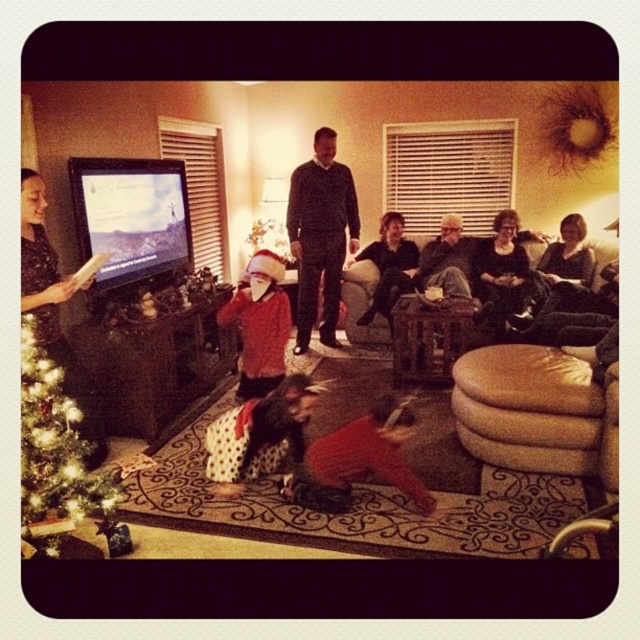
Between sweater-knit sweater at center and white dotted fabric at center, which one has more height?

With more height is sweater-knit sweater at center.

Between sweater-knit sweater at center and white dotted fabric at center, which one appears on the left side from the viewer's perspective?

Positioned to the left is white dotted fabric at center.

Is point (301, 328) positioned after point (259, 461)?

Yes, point (301, 328) is farther from viewer.

You are a GUI agent. You are given a task and a screenshot of the screen. Output one action in this format:
    pyautogui.click(x=<x>, y=<y>)
    Task: Click on the sweater-knit sweater at center
    The height and width of the screenshot is (640, 640).
    Given the screenshot: What is the action you would take?
    pyautogui.click(x=321, y=236)

At what (x,y) coordinates should I click in order to perform the action: click on velvet red pajamas at lower center. Please return your answer as a coordinate pair (x, y). This screenshot has width=640, height=640. Looking at the image, I should click on (365, 452).

Between point (387, 397) and point (412, 273), which one is positioned in front?

Point (387, 397) is in front.

Where is `velvet red pajamas at lower center`? velvet red pajamas at lower center is located at coordinates (365, 452).

Is point (48, 499) positioned in front of point (289, 406)?

Yes, point (48, 499) is closer to viewer.

The image size is (640, 640). What do you see at coordinates (58, 460) in the screenshot?
I see `green glittering christmas tree at lower left` at bounding box center [58, 460].

Between point (56, 556) and point (237, 422), which one is positioned behind?

Positioned behind is point (237, 422).

You are a GUI agent. You are given a task and a screenshot of the screen. Output one action in this format:
    pyautogui.click(x=<x>, y=<y>)
    Task: Click on the green glittering christmas tree at lower left
    
    Given the screenshot: What is the action you would take?
    pyautogui.click(x=58, y=460)